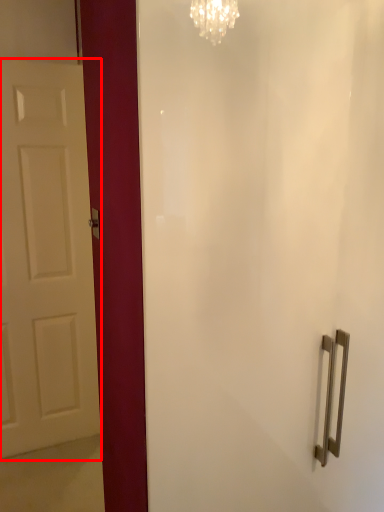
Question: Where is door (annotated by the red box) located in relation to door handle in the image?

Choices:
 (A) right
 (B) left

Answer: (B)